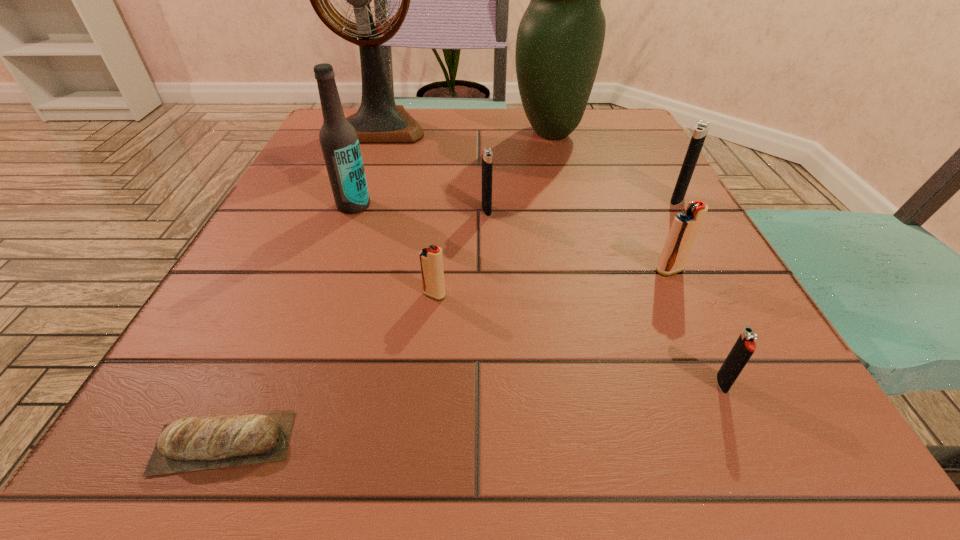
What are the coordinates of `beer bottle located at the left edge` in the screenshot? It's located at (338, 138).

Identify the location of pita bread present at the left edge. (228, 440).

Where is `vase that is at the right edge`? This screenshot has height=540, width=960. vase that is at the right edge is located at coordinates (560, 38).

Locate an element on the screen. This screenshot has height=540, width=960. object located in the far left corner section of the desktop is located at coordinates (378, 120).

The image size is (960, 540). I want to click on object at the near left corner, so click(x=228, y=440).

This screenshot has width=960, height=540. I want to click on object that is positioned at the far right corner, so click(560, 38).

Image resolution: width=960 pixels, height=540 pixels. In the image, there is a desktop. What are the coordinates of `vacant space at the far edge` in the screenshot? It's located at (536, 145).

Where is `free location at the near edge`? The width and height of the screenshot is (960, 540). free location at the near edge is located at coordinates (462, 472).

In the image, there is a desktop. At what (x,y) coordinates should I click in order to perform the action: click on vacant area at the left edge. Please return your answer as a coordinate pair (x, y). Looking at the image, I should click on (300, 219).

Where is `vacant space at the right edge of the desktop`? This screenshot has height=540, width=960. vacant space at the right edge of the desktop is located at coordinates (624, 165).